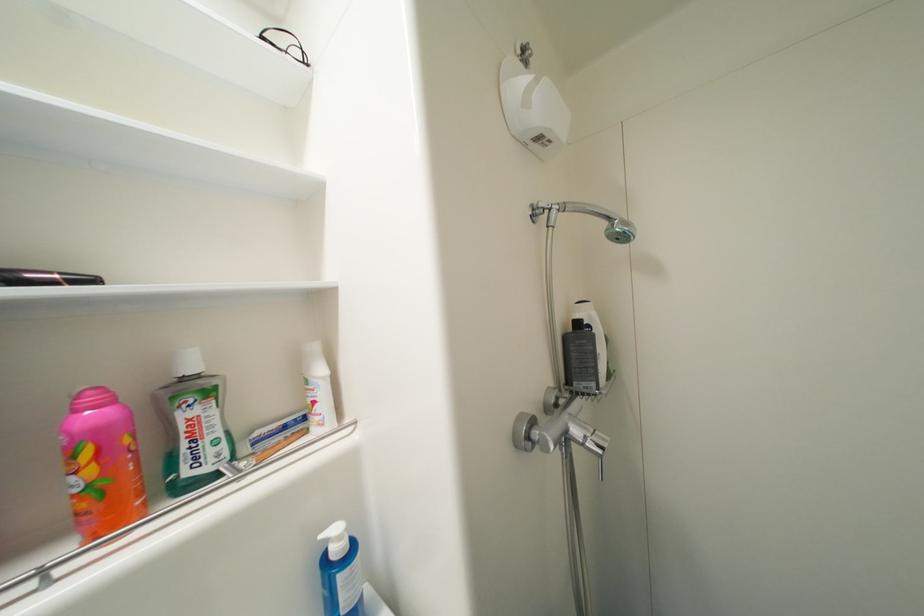
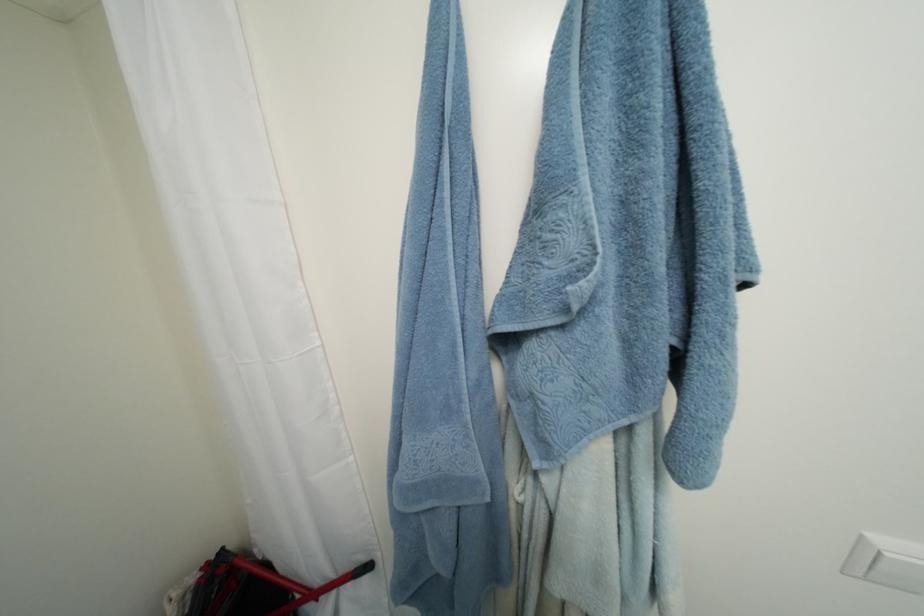
Question: The camera is either moving clockwise (left) or counter-clockwise (right) around the object. The first image is from the beginning of the video and the second image is from the end. Is the camera moving left or right when shooting the video?

Choices:
 (A) Left
 (B) Right

Answer: (A)